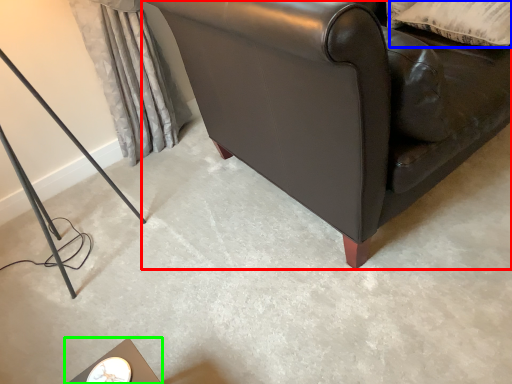
Question: Which object is positioned closest to studio couch (highlighted by a red box)? Select from pillow (highlighted by a blue box) and table (highlighted by a green box).

Choices:
 (A) pillow
 (B) table

Answer: (A)